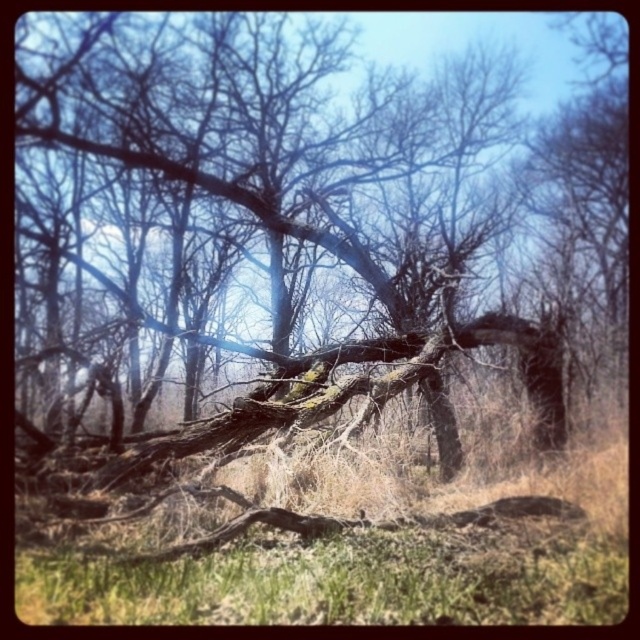
You are a small animal trying to cross the forest floor. You see the brown textured log at center and the green grass at center. Which one is higher and could potentially block your path?

The brown textured log at center is much taller than the green grass at center, so it could potentially block your path.

You are a hiker trying to cross a forest path and see the brown textured log at center and the green grass at center. Which one is wider?

The brown textured log at center is wider than the green grass at center.

You are a hiker navigating through the forest and come across the brown textured log at center. If you want to cross the log to reach the other side, would its position allow you to do so easily?

The brown textured log at center is located at point [314,216], which means it is positioned centrally in the frame, making it accessible for crossing.